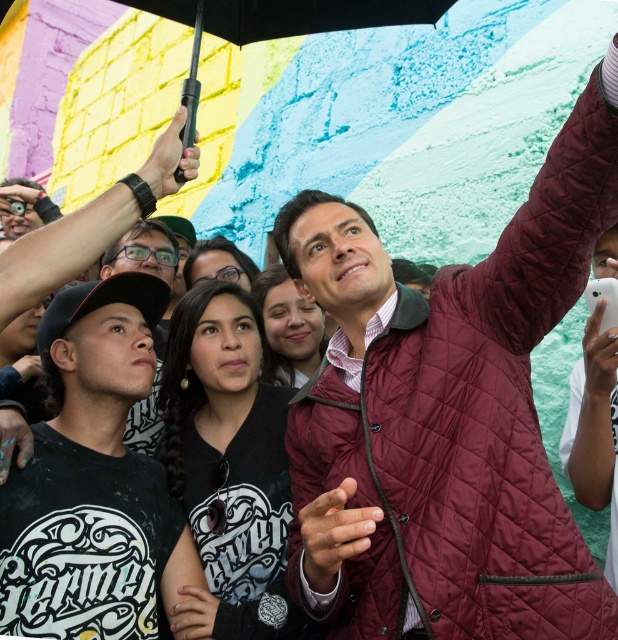
The height and width of the screenshot is (640, 618). Describe the element at coordinates (446, 416) in the screenshot. I see `maroon quilted jacket at upper right` at that location.

Is point (496, 570) positioned before point (195, 20)?

Yes.

This screenshot has height=640, width=618. In order to click on maroon quilted jacket at upper right in this screenshot , I will do `click(446, 416)`.

Who is more distant from viewer, (171,506) or (192,132)?

The point (171,506) is behind.

What do you see at coordinates (93, 480) in the screenshot?
I see `black printed t-shirt at lower left` at bounding box center [93, 480].

Where is `black printed t-shirt at lower left`? The width and height of the screenshot is (618, 640). black printed t-shirt at lower left is located at coordinates (93, 480).

Is maroon quilted jacket at upper right shorter than burgundy quilted jacket at upper right?

In fact, maroon quilted jacket at upper right may be taller than burgundy quilted jacket at upper right.

Measure the distance between point (591, 177) and camera.

Result: The distance of point (591, 177) from camera is 83.14 feet.

The height and width of the screenshot is (640, 618). Identify the location of maroon quilted jacket at upper right. (446, 416).